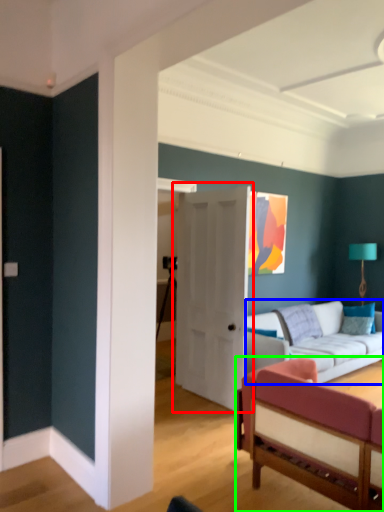
Question: Estimate the real-world distances between objects in this image. Which object is closer to door (highlighted by a red box), studio couch (highlighted by a blue box) or studio couch (highlighted by a green box)?

Choices:
 (A) studio couch
 (B) studio couch

Answer: (A)